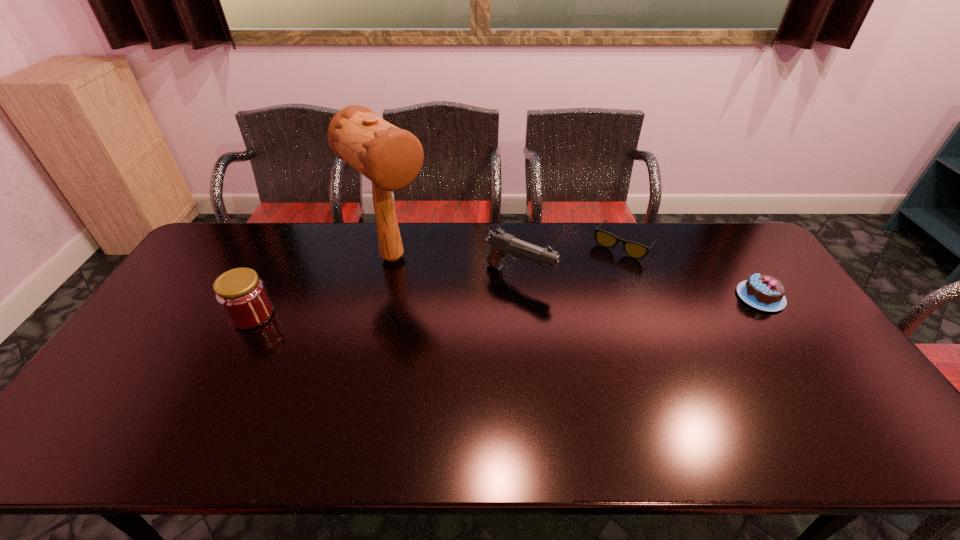
Find the location of a particular element. free spot located 0.300m on the strike surface of the mallet is located at coordinates (478, 333).

Locate an element on the screen. The height and width of the screenshot is (540, 960). free space located 0.310m on the strike surface of the mallet is located at coordinates 480,335.

Where is `vacant space located 0.160m in the direction the third object from left to right is aimed`? vacant space located 0.160m in the direction the third object from left to right is aimed is located at coordinates (598, 305).

You are a GUI agent. You are given a task and a screenshot of the screen. Output one action in this format:
    pyautogui.click(x=<x>, y=<y>)
    Task: Click on the free space located 0.250m in the direction the third object from left to right is aimed
    Image resolution: width=960 pixels, height=540 pixels.
    Given the screenshot: What is the action you would take?
    pyautogui.click(x=628, y=317)

Locate an element on the screen. This screenshot has width=960, height=540. free location located 0.400m in the direction the third object from left to right is aimed is located at coordinates (680, 338).

Locate an element on the screen. free space located on the front-facing side of the sunglasses is located at coordinates (573, 308).

The height and width of the screenshot is (540, 960). Identify the location of vacant region located on the front-facing side of the sunglasses. (585, 293).

This screenshot has width=960, height=540. I want to click on free space located 0.210m on the front-facing side of the sunglasses, so click(x=584, y=295).

This screenshot has height=540, width=960. Identify the location of mallet that is at the far edge. (390, 157).

At what (x,y) coordinates should I click in order to perform the action: click on gun located at the far edge. Please return your answer as a coordinate pair (x, y). Looking at the image, I should click on (503, 244).